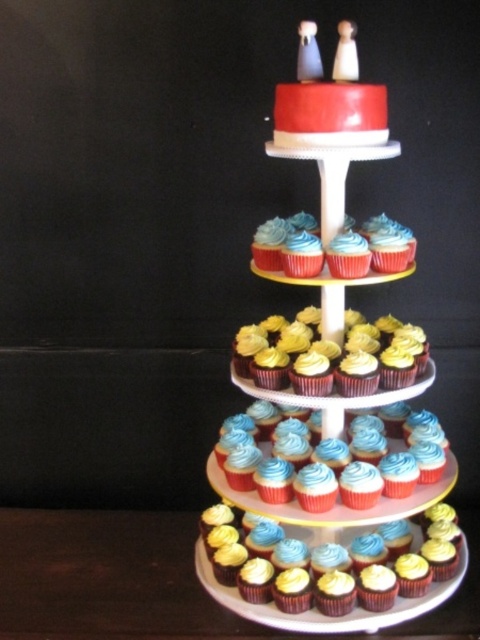
You are a guest at a wedding and want to choose a cupcake from the dessert stand. You see a matte blue frosting cupcake at center and a smooth chocolate cupcake at lower center. Which cupcake is located to the right of the other?

The matte blue frosting cupcake at center is positioned on the right side of the smooth chocolate cupcake at lower center.

What are the coordinates of the smooth red cake at upper center?

The smooth red cake at upper center is located at coordinates (330, 397).